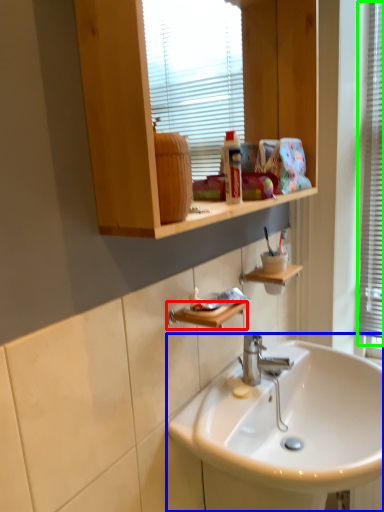
Question: Which object is positioned closest to shelf (highlighted by a red box)? Select from sink (highlighted by a blue box) and window frame (highlighted by a green box).

Choices:
 (A) sink
 (B) window frame

Answer: (A)